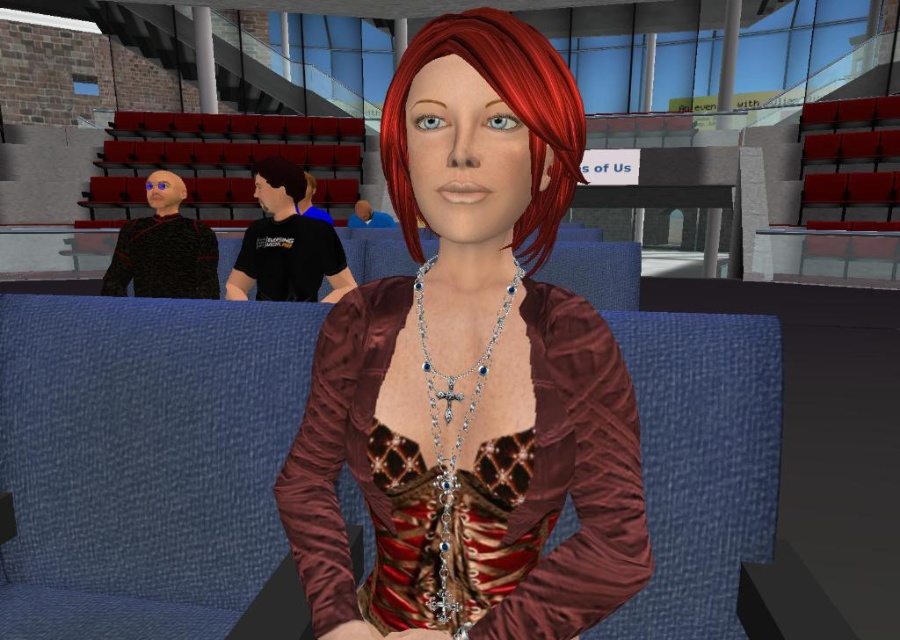
Does silver/glassy rosary at center have a smaller size compared to brown matte hair at center?

Yes, silver/glassy rosary at center is smaller than brown matte hair at center.

Between point (456, 396) and point (268, 173), which one is positioned in front?

Point (456, 396) is more forward.

Between point (510, 307) and point (272, 173), which one is positioned in front?

Point (510, 307) is more forward.

Identify the location of silver/glassy rosary at center. This screenshot has width=900, height=640. (454, 440).

Which is more to the left, shiny brown dress at center or shiny red hair at center?

shiny brown dress at center is more to the left.

Is point (312, 372) positioned before point (560, 58)?

That is False.

The image size is (900, 640). What are the coordinates of `shiny brown dress at center` in the screenshot? It's located at (470, 372).

Between point (591, 573) and point (442, 452), which one is positioned behind?

Point (442, 452)

Where is `shiny brown dress at center`? The height and width of the screenshot is (640, 900). shiny brown dress at center is located at coordinates (470, 372).